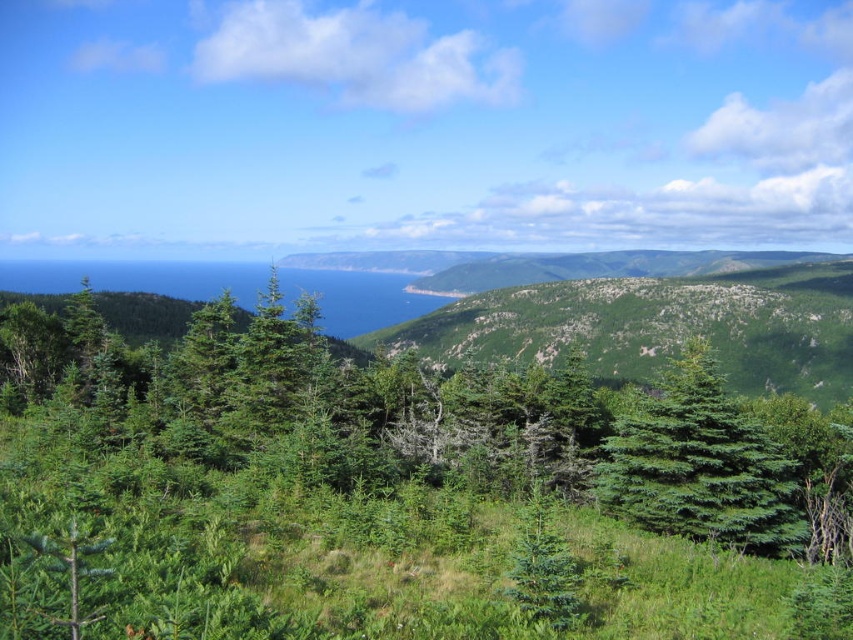
Question: Which of the following is the farthest from the observer?

Choices:
 (A) (683, 380)
 (B) (572, 564)

Answer: (A)

Question: Among these points, which one is farthest from the camera?

Choices:
 (A) (526, 602)
 (B) (643, 480)

Answer: (B)

Question: Is green matte tree at center smaller than green matte evergreen tree at center?

Choices:
 (A) no
 (B) yes

Answer: (A)

Question: Does green matte tree at center have a greater width compared to green matte evergreen tree at center?

Choices:
 (A) no
 (B) yes

Answer: (B)

Question: Is green matte tree at center thinner than green matte evergreen tree at center?

Choices:
 (A) no
 (B) yes

Answer: (A)